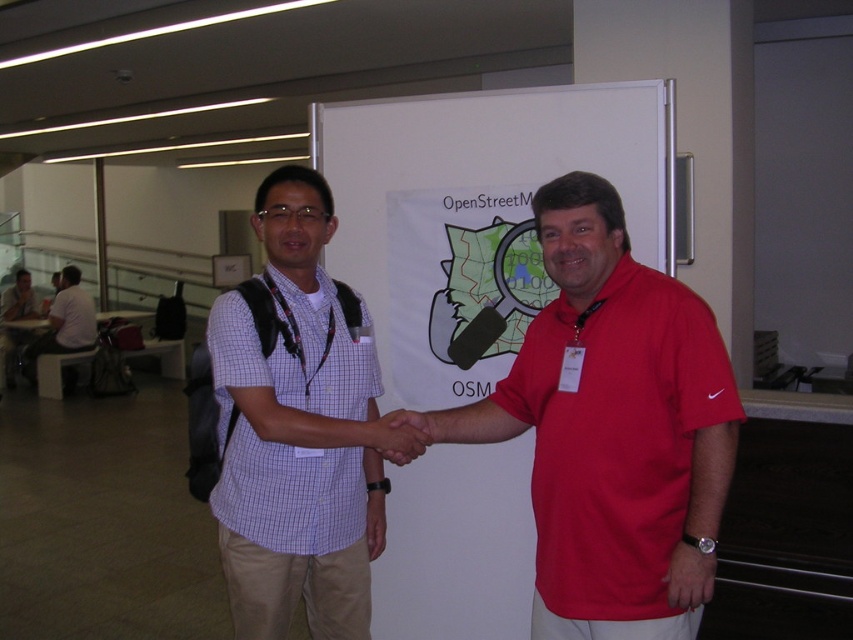
This screenshot has height=640, width=853. What do you see at coordinates (613, 429) in the screenshot?
I see `red cotton polo shirt at center` at bounding box center [613, 429].

Does red cotton polo shirt at center have a smaller size compared to matte black hand at center?

No, red cotton polo shirt at center is not smaller than matte black hand at center.

The width and height of the screenshot is (853, 640). What do you see at coordinates (613, 429) in the screenshot? I see `red cotton polo shirt at center` at bounding box center [613, 429].

The image size is (853, 640). Identify the location of red cotton polo shirt at center. (613, 429).

Is red cotton polo shirt at center wider than white checkered shirt at center?

Indeed, red cotton polo shirt at center has a greater width compared to white checkered shirt at center.

Is red cotton polo shirt at center further to the viewer compared to white checkered shirt at center?

No, red cotton polo shirt at center is in front of white checkered shirt at center.

Locate an element on the screen. Image resolution: width=853 pixels, height=640 pixels. red cotton polo shirt at center is located at coordinates (613, 429).

This screenshot has width=853, height=640. I want to click on red cotton polo shirt at center, so click(x=613, y=429).

Can you confirm if white shirt at left is positioned to the right of matte black hand at center?

In fact, white shirt at left is to the left of matte black hand at center.

Is white shirt at left to the left of matte black hand at center from the viewer's perspective?

Indeed, white shirt at left is positioned on the left side of matte black hand at center.

Between point (84, 346) and point (392, 422), which one is positioned in front?

Point (392, 422) is more forward.

Find the location of `white shirt at left`. white shirt at left is located at coordinates (62, 323).